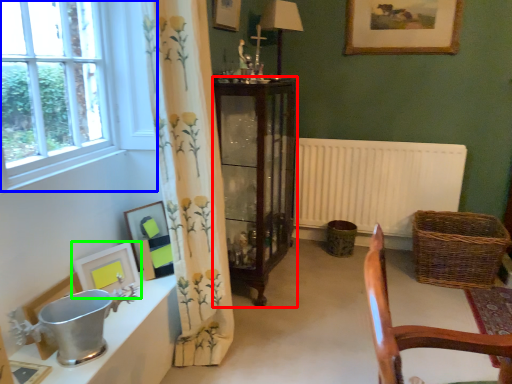
Question: Estimate the real-world distances between objects in this image. Which object is closer to cabinetry (highlighted by a red box), window (highlighted by a blue box) or picture frame (highlighted by a green box)?

Choices:
 (A) window
 (B) picture frame

Answer: (A)